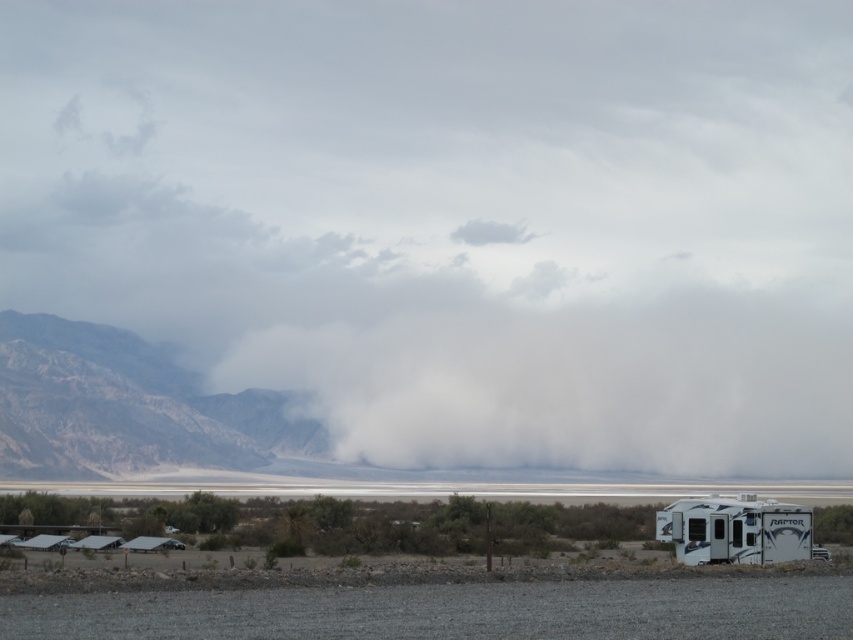
Question: Among these points, which one is nearest to the camera?

Choices:
 (A) (13, 371)
 (B) (718, 557)

Answer: (B)

Question: Does rugged brown mountain at left come in front of white glossy recreational vehicle at lower right?

Choices:
 (A) no
 (B) yes

Answer: (A)

Question: Does rugged brown mountain at left have a lesser width compared to white glossy recreational vehicle at lower right?

Choices:
 (A) no
 (B) yes

Answer: (A)

Question: Which object appears closest to the camera in this image?

Choices:
 (A) white glossy recreational vehicle at lower right
 (B) rugged brown mountain at left

Answer: (A)

Question: Does rugged brown mountain at left lie in front of white glossy recreational vehicle at lower right?

Choices:
 (A) yes
 (B) no

Answer: (B)